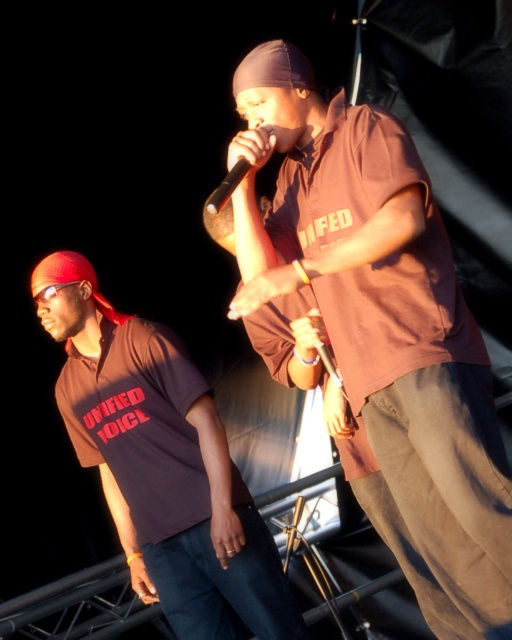
Is point (315, 232) closer to viewer compared to point (228, 188)?

No, it is behind (228, 188).

Measure the distance between brown matte shirt at center and camera.

brown matte shirt at center and camera are 1.84 meters apart from each other.

Locate an element on the screen. The image size is (512, 640). brown matte shirt at center is located at coordinates (382, 330).

Between brown matte shirt at center and matte brown shirt at center, which one is positioned higher?

brown matte shirt at center

The width and height of the screenshot is (512, 640). Describe the element at coordinates (382, 330) in the screenshot. I see `brown matte shirt at center` at that location.

Locate an element on the screen. This screenshot has width=512, height=640. brown matte shirt at center is located at coordinates (382, 330).

Can you confirm if matte brown shirt at center is positioned to the right of black matte microphone at center?

Incorrect, matte brown shirt at center is not on the right side of black matte microphone at center.

Which of these two, matte brown shirt at center or black matte microphone at center, stands taller?

matte brown shirt at center

Locate an element on the screen. This screenshot has height=640, width=512. matte brown shirt at center is located at coordinates (161, 465).